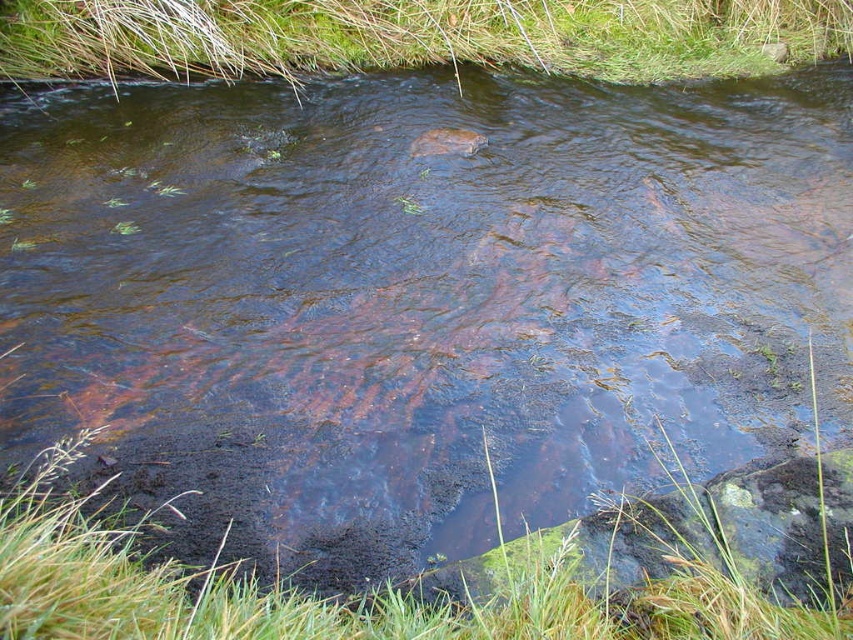
Is point (828, 636) behind point (825, 22)?

No, (828, 636) is closer to viewer.

Does green grass at lower left have a lesser width compared to green algae at upper center?

No, green grass at lower left is not thinner than green algae at upper center.

Locate an element on the screen. The width and height of the screenshot is (853, 640). green grass at lower left is located at coordinates (352, 596).